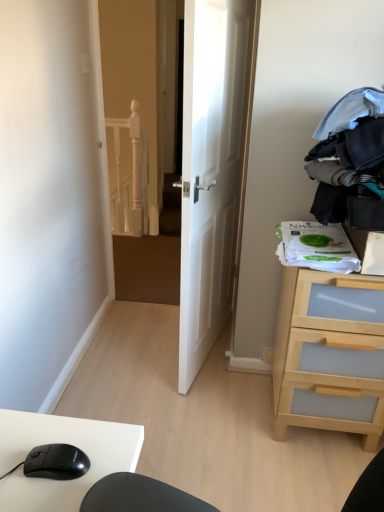
This screenshot has width=384, height=512. In order to click on free point in front of light wood/transparent drawer at right in this screenshot , I will do `click(304, 479)`.